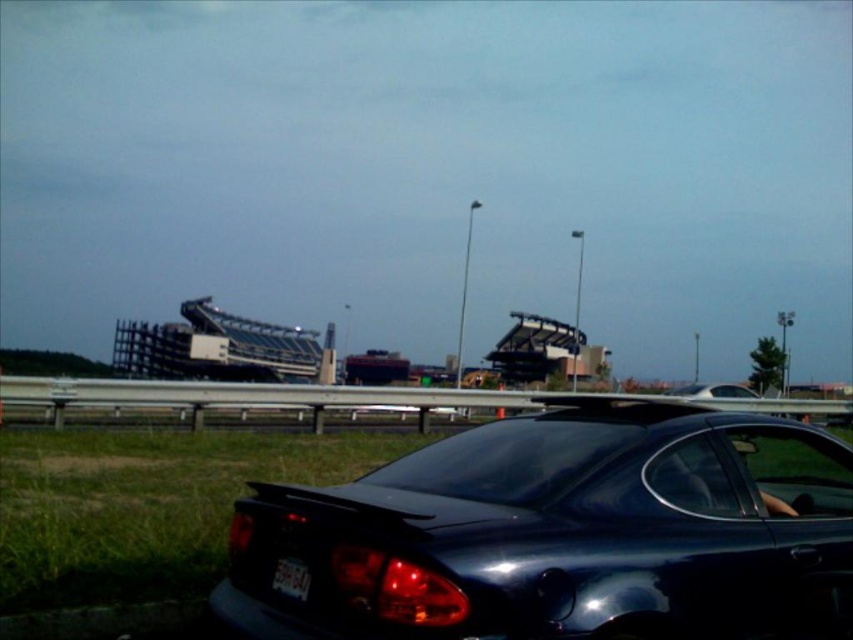
Question: Which of the following is the closest to the observer?

Choices:
 (A) white plastic license plate at lower center
 (B) glossy dark blue car at lower center

Answer: (B)

Question: Can you confirm if glossy dark blue car at lower center is positioned to the right of white plastic license plate at lower center?

Choices:
 (A) no
 (B) yes

Answer: (B)

Question: Is glossy dark blue car at lower center closer to the viewer compared to white plastic license plate at lower center?

Choices:
 (A) yes
 (B) no

Answer: (A)

Question: Is glossy dark blue car at lower center to the right of white plastic license plate at lower center from the viewer's perspective?

Choices:
 (A) no
 (B) yes

Answer: (B)

Question: Which of the following is the farthest from the observer?

Choices:
 (A) glossy dark blue car at lower center
 (B) white plastic license plate at lower center

Answer: (B)

Question: Which of the following is the closest to the observer?

Choices:
 (A) glossy dark blue car at lower center
 (B) white plastic license plate at lower center

Answer: (A)